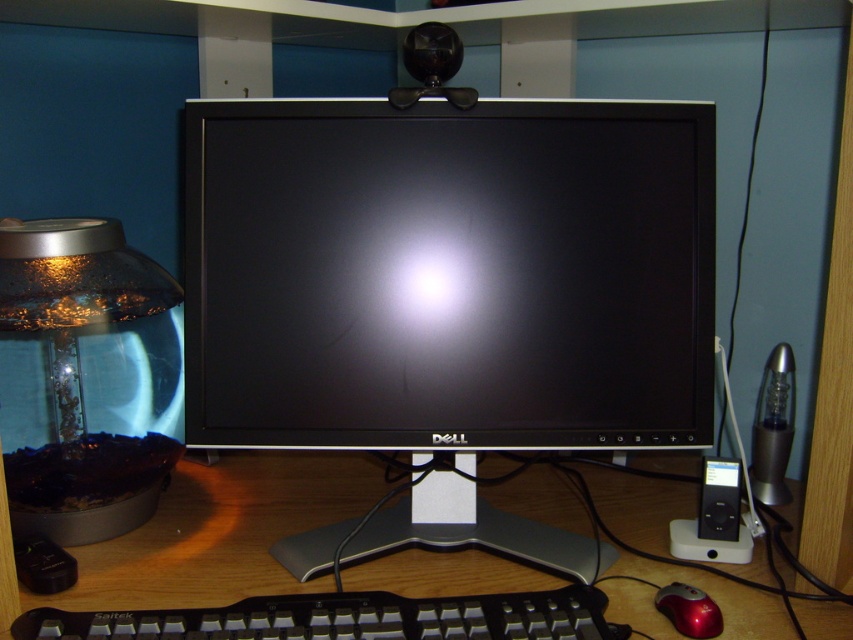
Question: Can you confirm if black glossy monitor at center is bigger than black plastic ipod at lower right?

Choices:
 (A) yes
 (B) no

Answer: (A)

Question: Among these objects, which one is nearest to the camera?

Choices:
 (A) black plastic ipod at lower right
 (B) wooden at center
 (C) black plastic keyboard at center

Answer: (C)

Question: Which of these objects is positioned farthest from the black plastic ipod at lower right?

Choices:
 (A) shiny red mouse at lower right
 (B) black plastic keyboard at center
 (C) wooden at center

Answer: (B)

Question: Is black glossy monitor at center bigger than shiny red mouse at lower right?

Choices:
 (A) yes
 (B) no

Answer: (A)

Question: Which of these objects is positioned farthest from the black glossy monitor at center?

Choices:
 (A) black plastic ipod at lower right
 (B) wooden at center

Answer: (A)

Question: Where is black plastic keyboard at center located in relation to black plastic ipod at lower right in the image?

Choices:
 (A) right
 (B) left

Answer: (B)